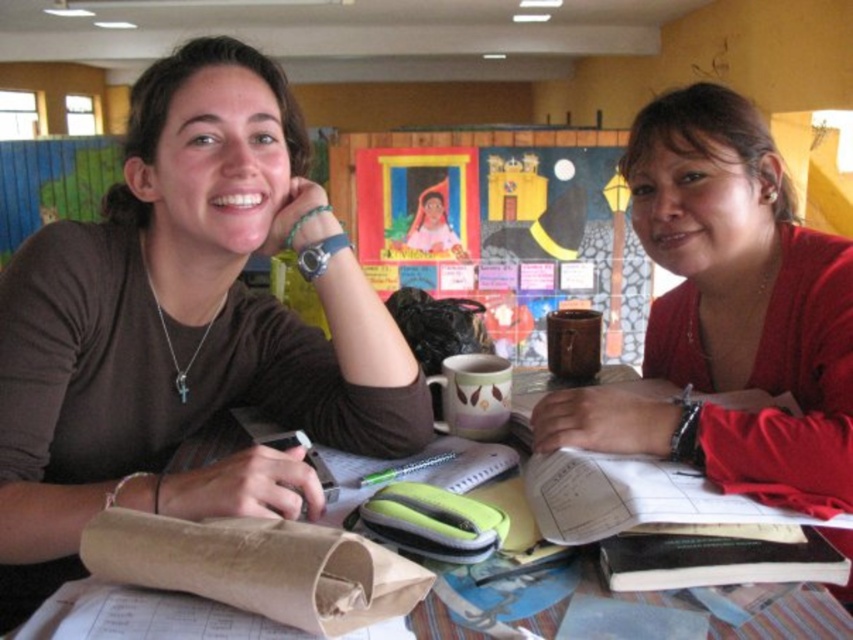
Is point (769, 442) closer to camera compared to point (769, 525)?

That is False.

Between matte red sweater at center and brown paper bag at lower left, which one is positioned higher?

matte red sweater at center

Identify the location of matte red sweater at center. Image resolution: width=853 pixels, height=640 pixels. (728, 314).

Can you confirm if painted cardboard bulletin board at center is shorter than brown paper bag at lower left?

No, painted cardboard bulletin board at center is not shorter than brown paper bag at lower left.

Does point (422, 192) come in front of point (780, 577)?

No, it is not.

Identify the location of painted cardboard bulletin board at center. (498, 227).

Is brown matte shirt at center further to camera compared to painted cardboard bulletin board at center?

No, it is in front of painted cardboard bulletin board at center.

Is brown matte shirt at center wider than painted cardboard bulletin board at center?

No, brown matte shirt at center is not wider than painted cardboard bulletin board at center.

Which is in front, point (184, 364) or point (570, 157)?

Point (184, 364) is in front.

Locate an element on the screen. This screenshot has width=853, height=640. brown matte shirt at center is located at coordinates (184, 326).